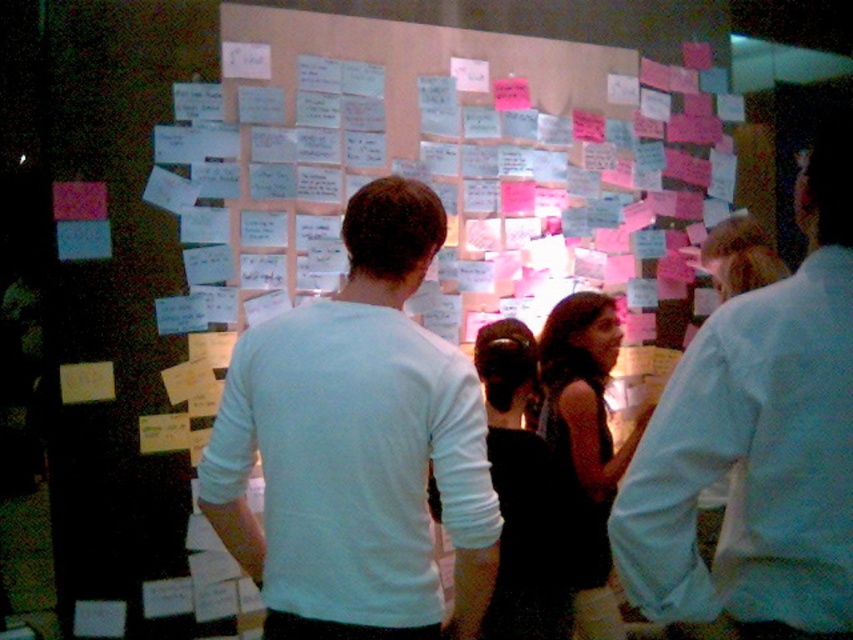
Question: Among these points, which one is nearest to the camera?

Choices:
 (A) [x=550, y=556]
 (B) [x=682, y=500]
 (C) [x=579, y=376]

Answer: (B)

Question: Can you confirm if white matte shirt at center is bigger than dark brown textured dress at center?

Choices:
 (A) yes
 (B) no

Answer: (B)

Question: Does white matte shirt at upper right have a larger size compared to dark brown textured dress at center?

Choices:
 (A) yes
 (B) no

Answer: (B)

Question: Does black satin dress at center appear over dark brown textured dress at center?

Choices:
 (A) no
 (B) yes

Answer: (A)

Question: Which of these objects is positioned closest to the white matte shirt at upper right?

Choices:
 (A) black satin dress at center
 (B) dark brown textured dress at center
 (C) white matte shirt at center

Answer: (C)

Question: Which of the following is the closest to the observer?

Choices:
 (A) white matte shirt at upper right
 (B) dark brown textured dress at center

Answer: (A)